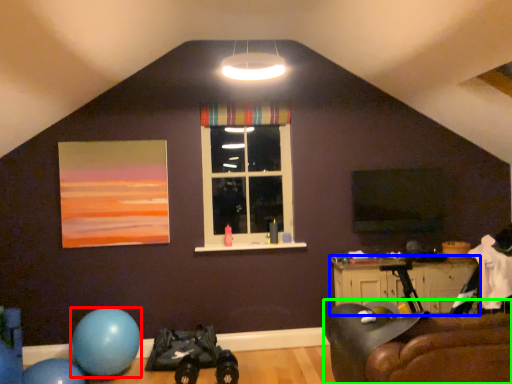
Question: Based on their relative distances, which object is nearer to balloon (highlighted by a red box)? Choose from table (highlighted by a blue box) and studio couch (highlighted by a green box).

Choices:
 (A) table
 (B) studio couch

Answer: (A)